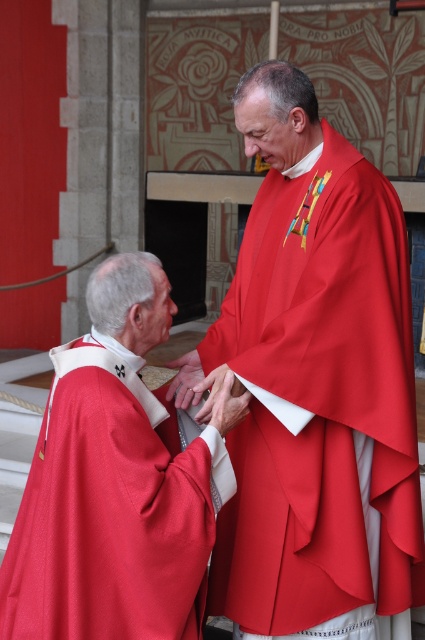
Can you confirm if matte red robe at center is positioned above matte red cape at lower left?

Yes, matte red robe at center is above matte red cape at lower left.

Is matte red robe at center thinner than matte red cape at lower left?

No.

The height and width of the screenshot is (640, 425). What do you see at coordinates (314, 385) in the screenshot?
I see `matte red robe at center` at bounding box center [314, 385].

This screenshot has width=425, height=640. Find the location of `matte red robe at center`. matte red robe at center is located at coordinates (314, 385).